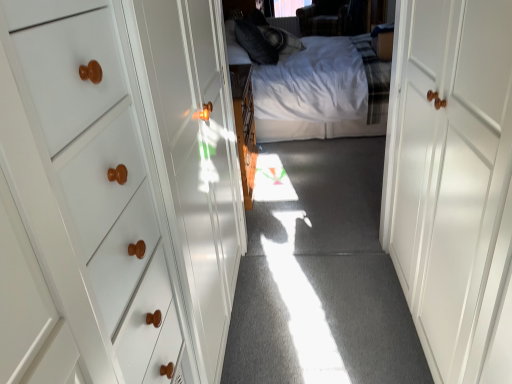
Question: From the image's perspective, does white cotton bed at center appear lower than white glossy door at right?

Choices:
 (A) yes
 (B) no

Answer: (B)

Question: Are white cotton bed at center and white glossy door at right located far from each other?

Choices:
 (A) no
 (B) yes

Answer: (B)

Question: Is white cotton bed at center smaller than white glossy door at right?

Choices:
 (A) no
 (B) yes

Answer: (A)

Question: From a real-world perspective, does white cotton bed at center stand above white glossy door at right?

Choices:
 (A) yes
 (B) no

Answer: (B)

Question: From a real-world perspective, is white cotton bed at center under white glossy door at right?

Choices:
 (A) yes
 (B) no

Answer: (A)

Question: Could you tell me if white cotton bed at center is turned towards white glossy door at right?

Choices:
 (A) no
 (B) yes

Answer: (A)

Question: Is white glossy door at right touching white cotton bed at center?

Choices:
 (A) no
 (B) yes

Answer: (A)

Question: From the image's perspective, would you say white glossy door at right is shown under white cotton bed at center?

Choices:
 (A) yes
 (B) no

Answer: (A)

Question: Is the position of white glossy door at right less distant than that of white cotton bed at center?

Choices:
 (A) no
 (B) yes

Answer: (B)

Question: Is white glossy door at right not within white cotton bed at center?

Choices:
 (A) yes
 (B) no

Answer: (A)

Question: Is white glossy door at right facing towards white cotton bed at center?

Choices:
 (A) yes
 (B) no

Answer: (B)

Question: Does white glossy door at right have a lesser height compared to white cotton bed at center?

Choices:
 (A) yes
 (B) no

Answer: (A)

Question: Is white glossy door at right situated inside white cotton bed at center or outside?

Choices:
 (A) outside
 (B) inside

Answer: (A)